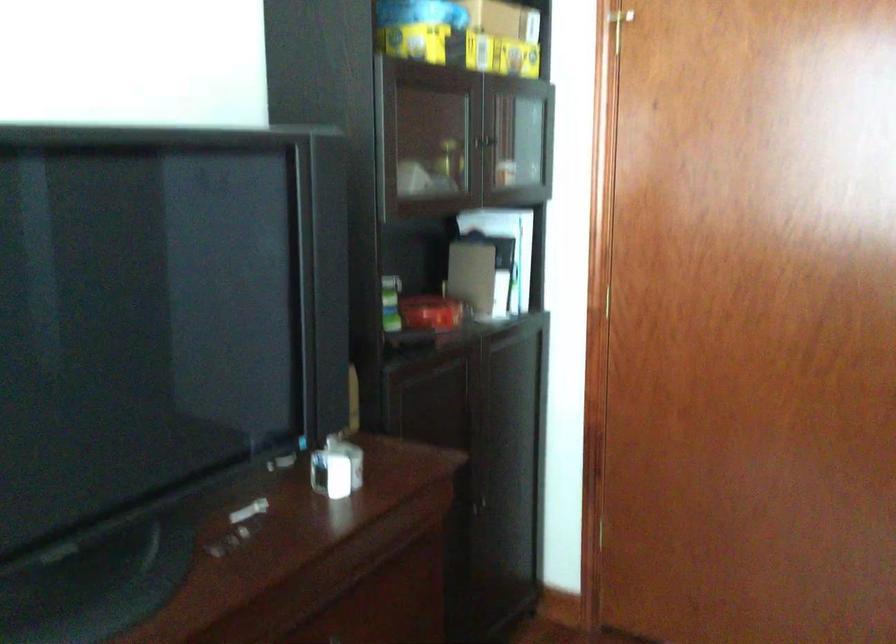
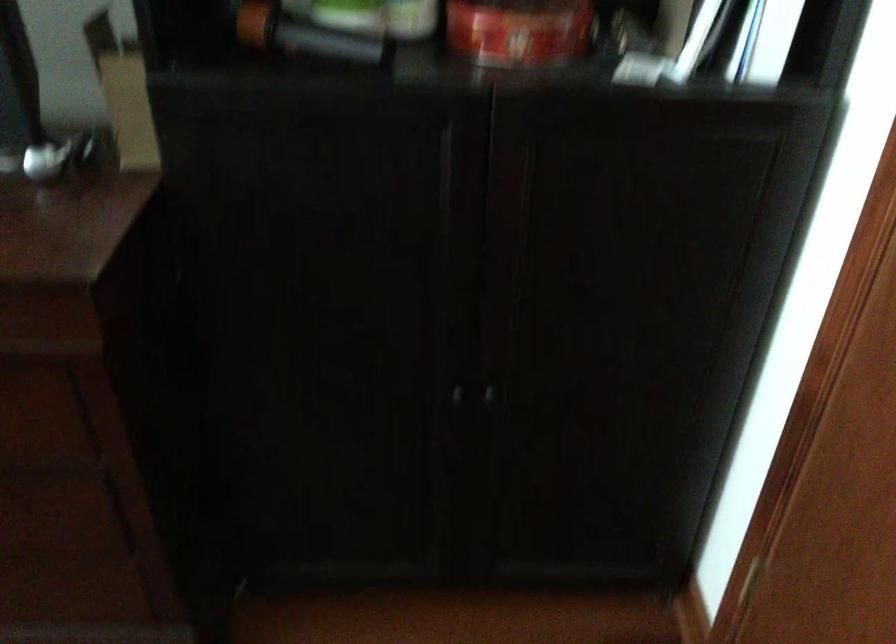
Find the pixel in the second image that matches (392,339) in the first image.

(304, 35)